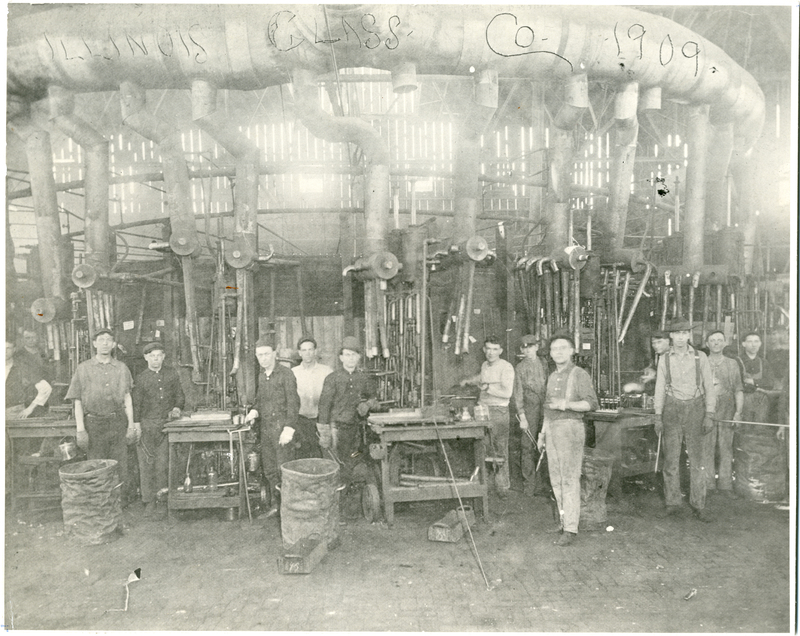
In order to click on table in this screenshot , I will do `click(214, 432)`, `click(393, 427)`, `click(32, 422)`, `click(606, 424)`.